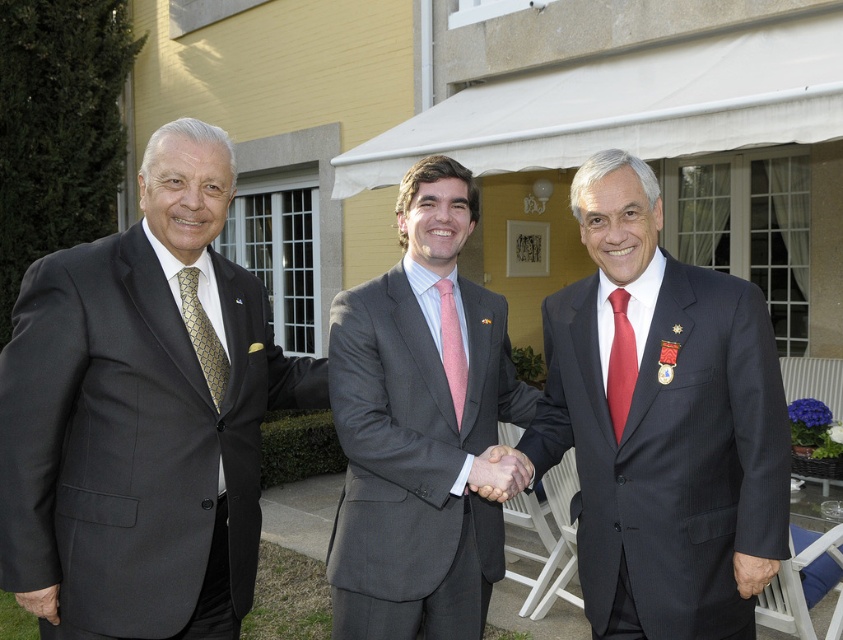
From the picture: You are a photographer at the event and need to ensure that the gold textured tie at left and the matte black hand at center are both visible in the photo. Given their sizes, which object might require more careful framing to ensure it doesn not get lost in the composition?

The matte black hand at center is smaller than the gold textured tie at left, so it might require more careful framing to ensure it doesn not get lost in the composition.

You are a photographer at the event and need to position a small flower arrangement exactly where the matte black hand at center is currently located. What are the coordinates where you should place the flower arrangement?

The coordinates for the matte black hand at center are (498,472), so you should place the flower arrangement at those coordinates.